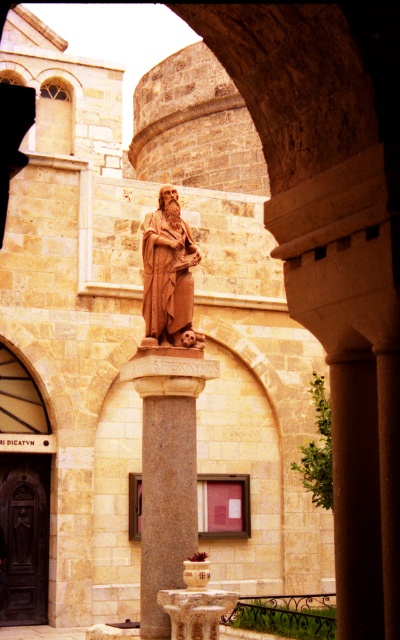
Question: Can you confirm if granite column at center is wider than white marble fountain at center?

Choices:
 (A) no
 (B) yes

Answer: (B)

Question: Which of these objects is positioned closest to the white marble fountain at center?

Choices:
 (A) brown stone statue at center
 (B) granite column at center

Answer: (B)

Question: Which of these objects is positioned closest to the granite column at center?

Choices:
 (A) white marble fountain at center
 (B) brown stone statue at center

Answer: (A)

Question: Estimate the real-world distances between objects in this image. Which object is closer to the granite column at center?

Choices:
 (A) brown stone statue at center
 (B) white marble fountain at center

Answer: (B)

Question: Is granite column at center to the left of white marble fountain at center from the viewer's perspective?

Choices:
 (A) yes
 (B) no

Answer: (A)

Question: Can you confirm if granite column at center is wider than white marble fountain at center?

Choices:
 (A) yes
 (B) no

Answer: (A)